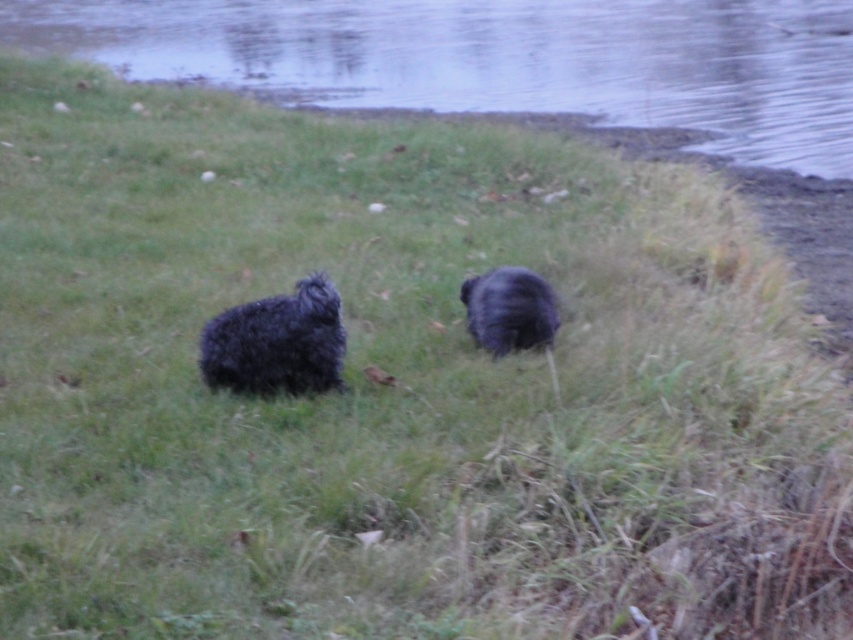
Question: Does fuzzy black dog at left have a greater width compared to black fluffy dog at center?

Choices:
 (A) no
 (B) yes

Answer: (B)

Question: Is the position of fuzzy black dog at left less distant than that of black fluffy dog at center?

Choices:
 (A) yes
 (B) no

Answer: (A)

Question: Can you confirm if smooth water at center is positioned above black fluffy dog at center?

Choices:
 (A) no
 (B) yes

Answer: (B)

Question: Which point is closer to the camera?

Choices:
 (A) (x=242, y=381)
 (B) (x=467, y=328)

Answer: (A)

Question: Which object is positioned closest to the fuzzy black dog at left?

Choices:
 (A) smooth water at center
 (B) black fluffy dog at center

Answer: (B)

Question: Which point is closer to the camera taking this photo?

Choices:
 (A) (268, 378)
 (B) (778, 70)
 (C) (509, 301)

Answer: (A)